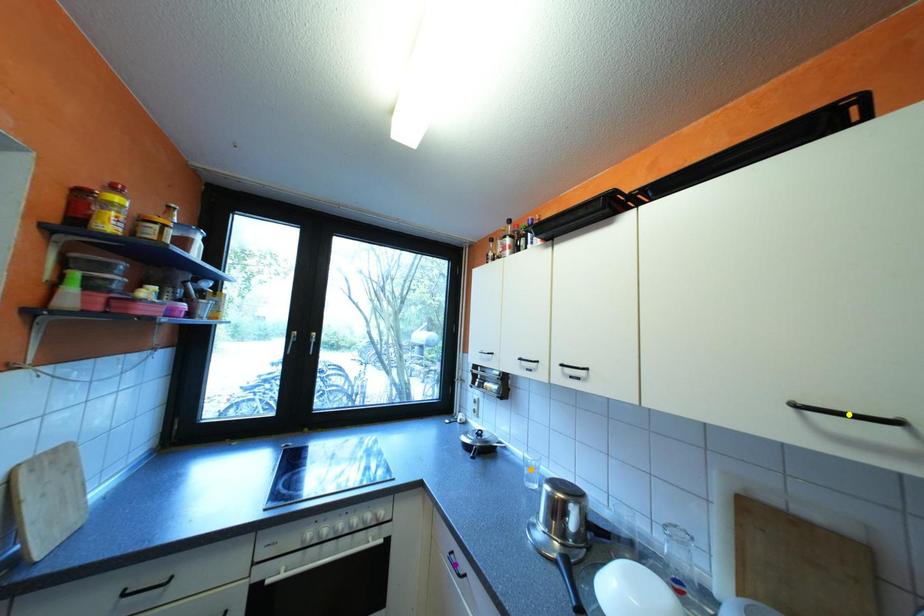
Order these from farthest to nearest:
1. yellow point
2. orange point
3. purple point

orange point < purple point < yellow point